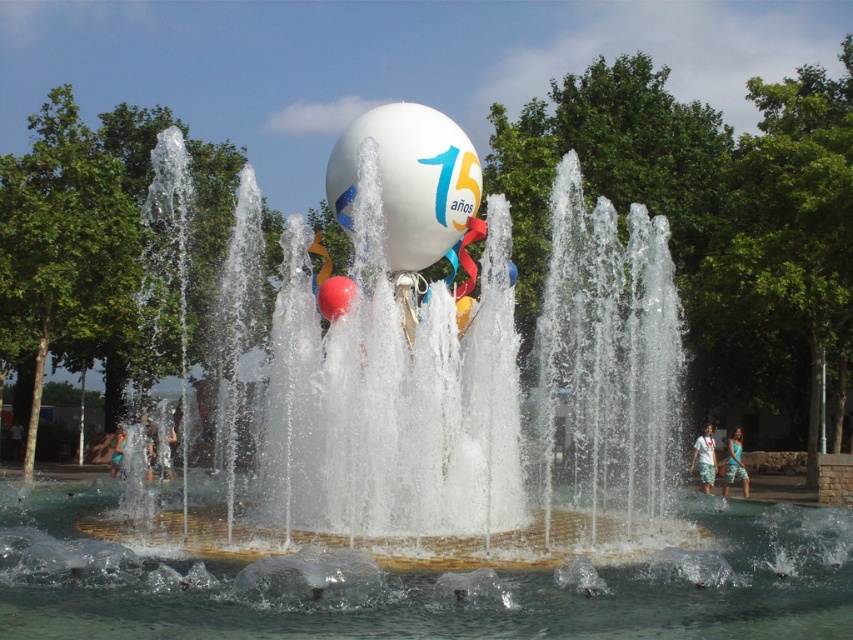
You are a photographer standing at the edge of the fountain. You want to capture a photo where both the clear water at center and the white cotton shirt at lower right are visible. Which object will appear taller in the photo?

The white cotton shirt at lower right will appear taller in the photo because the clear water at center is not as tall as the white cotton shirt at lower right.

You are at an outdoor event and see a rubber balloon at center and a white cotton shirt at lower right. Which object is located higher from the ground?

The rubber balloon at center is positioned over the white cotton shirt at lower right, so it is higher from the ground.